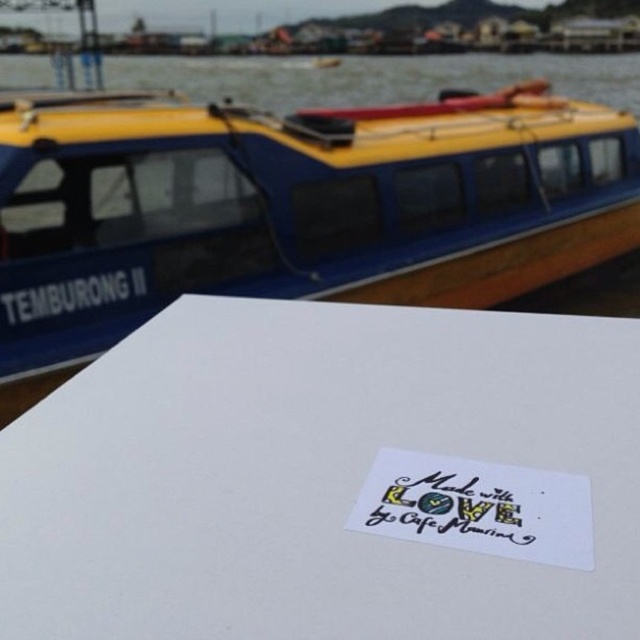
Question: Which object appears closest to the camera in this image?

Choices:
 (A) yellow matte boat at upper left
 (B) handwritten paper at center

Answer: (B)

Question: Is white paper at lower center positioned behind yellow matte boat at upper left?

Choices:
 (A) yes
 (B) no

Answer: (B)

Question: Which object is positioned closest to the handwritten paper at center?

Choices:
 (A) white paper at lower center
 (B) yellow matte boat at upper left

Answer: (A)

Question: Is white paper at lower center bigger than handwritten paper at center?

Choices:
 (A) no
 (B) yes

Answer: (B)

Question: Can you confirm if white paper at lower center is positioned to the right of yellow matte boat at upper left?

Choices:
 (A) yes
 (B) no

Answer: (A)

Question: Which object appears farthest from the camera in this image?

Choices:
 (A) handwritten paper at center
 (B) white paper at lower center
 (C) yellow matte boat at upper left

Answer: (C)